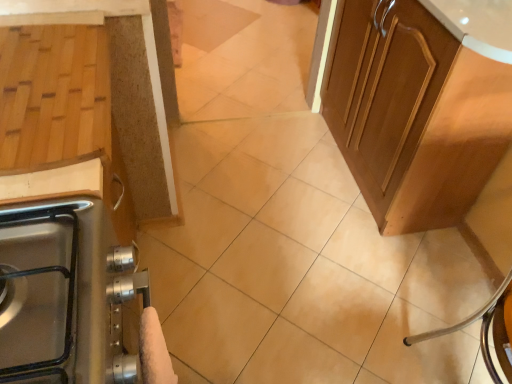
Where is `wooden cutting board at left, the 1th cabinetry when ordered from left to right`? This screenshot has height=384, width=512. wooden cutting board at left, the 1th cabinetry when ordered from left to right is located at coordinates (127, 87).

At what (x,y) coordinates should I click in order to perform the action: click on white fluffy hand towel at lower left. Please return your answer as a coordinate pair (x, y). The height and width of the screenshot is (384, 512). Looking at the image, I should click on [154, 351].

Where is `hand towel in front of the glossy wood cabinet at upper right, which is the 2th cabinetry in left-to-right order`? hand towel in front of the glossy wood cabinet at upper right, which is the 2th cabinetry in left-to-right order is located at coordinates (154, 351).

Based on the photo, from the image's perspective, is glossy wood cabinet at upper right, which is the 2th cabinetry in left-to-right order, above white fluffy hand towel at lower left?

Yes.

Could you tell me if glossy wood cabinet at upper right, which is counted as the first cabinetry, starting from the right, is facing white fluffy hand towel at lower left?

No, glossy wood cabinet at upper right, which is counted as the first cabinetry, starting from the right, does not turn towards white fluffy hand towel at lower left.

From a real-world perspective, is glossy wood cabinet at upper right, which is counted as the first cabinetry, starting from the right, positioned under white fluffy hand towel at lower left based on gravity?

Indeed, from a real-world perspective, glossy wood cabinet at upper right, which is counted as the first cabinetry, starting from the right, is positioned beneath white fluffy hand towel at lower left.

Which point is more forward, [110,9] or [402,203]?

The point [110,9] is closer to the camera.

Is wooden cutting board at left, positioned as the 2th cabinetry in right-to-left order, with glossy wood cabinet at upper right, which is the 2th cabinetry in left-to-right order?

wooden cutting board at left, positioned as the 2th cabinetry in right-to-left order, and glossy wood cabinet at upper right, which is the 2th cabinetry in left-to-right order, are not in contact.

Is wooden cutting board at left, positioned as the 2th cabinetry in right-to-left order, positioned beyond the bounds of glossy wood cabinet at upper right, which is counted as the first cabinetry, starting from the right?

wooden cutting board at left, positioned as the 2th cabinetry in right-to-left order, is positioned outside glossy wood cabinet at upper right, which is counted as the first cabinetry, starting from the right.

From a real-world perspective, is wooden cutting board at left, the 1th cabinetry when ordered from left to right, positioned over glossy wood cabinet at upper right, which is counted as the first cabinetry, starting from the right, based on gravity?

No, from a real-world perspective, wooden cutting board at left, the 1th cabinetry when ordered from left to right, is not over glossy wood cabinet at upper right, which is counted as the first cabinetry, starting from the right

Is white fluffy hand towel at lower left directly adjacent to wooden cutting board at left, the 1th cabinetry when ordered from left to right?

No.

From a real-world perspective, which object rests below the other?

From a 3D spatial view, wooden cutting board at left, positioned as the 2th cabinetry in right-to-left order, is below.

Is point (148, 322) positioned after point (117, 3)?

No, it is in front of (117, 3).

Who is bigger, white fluffy hand towel at lower left or wooden cutting board at left, positioned as the 2th cabinetry in right-to-left order?

wooden cutting board at left, positioned as the 2th cabinetry in right-to-left order, is bigger.

From a real-world perspective, is glossy wood cabinet at upper right, which is the 2th cabinetry in left-to-right order, positioned above or below wooden cutting board at left, positioned as the 2th cabinetry in right-to-left order?

glossy wood cabinet at upper right, which is the 2th cabinetry in left-to-right order, is situated higher than wooden cutting board at left, positioned as the 2th cabinetry in right-to-left order, in the real world.

Between glossy wood cabinet at upper right, which is the 2th cabinetry in left-to-right order, and wooden cutting board at left, the 1th cabinetry when ordered from left to right, which one has larger size?

glossy wood cabinet at upper right, which is the 2th cabinetry in left-to-right order.

Is glossy wood cabinet at upper right, which is the 2th cabinetry in left-to-right order, at the right side of wooden cutting board at left, the 1th cabinetry when ordered from left to right?

Yes, glossy wood cabinet at upper right, which is the 2th cabinetry in left-to-right order, is to the right of wooden cutting board at left, the 1th cabinetry when ordered from left to right.

Could you tell me if white fluffy hand towel at lower left is facing glossy wood cabinet at upper right, which is counted as the first cabinetry, starting from the right?

No, white fluffy hand towel at lower left is not aimed at glossy wood cabinet at upper right, which is counted as the first cabinetry, starting from the right.

In terms of width, does white fluffy hand towel at lower left look wider or thinner when compared to glossy wood cabinet at upper right, which is the 2th cabinetry in left-to-right order?

Considering their sizes, white fluffy hand towel at lower left looks slimmer than glossy wood cabinet at upper right, which is the 2th cabinetry in left-to-right order.

Based on the photo, between white fluffy hand towel at lower left and glossy wood cabinet at upper right, which is the 2th cabinetry in left-to-right order, which one has more height?

glossy wood cabinet at upper right, which is the 2th cabinetry in left-to-right order.

Is white fluffy hand towel at lower left far from glossy wood cabinet at upper right, which is counted as the first cabinetry, starting from the right?

Indeed, white fluffy hand towel at lower left is not near glossy wood cabinet at upper right, which is counted as the first cabinetry, starting from the right.

From the picture: Considering their positions, is wooden cutting board at left, positioned as the 2th cabinetry in right-to-left order, located in front of or behind white fluffy hand towel at lower left?

Clearly, wooden cutting board at left, positioned as the 2th cabinetry in right-to-left order, is behind white fluffy hand towel at lower left.

Considering the sizes of objects wooden cutting board at left, the 1th cabinetry when ordered from left to right, and white fluffy hand towel at lower left in the image provided, who is bigger, wooden cutting board at left, the 1th cabinetry when ordered from left to right, or white fluffy hand towel at lower left?

wooden cutting board at left, the 1th cabinetry when ordered from left to right, is bigger.

Would you say wooden cutting board at left, the 1th cabinetry when ordered from left to right, is outside white fluffy hand towel at lower left?

Yes, wooden cutting board at left, the 1th cabinetry when ordered from left to right, is not within white fluffy hand towel at lower left.

The height and width of the screenshot is (384, 512). Find the location of `cabinetry that appears on the right of white fluffy hand towel at lower left`. cabinetry that appears on the right of white fluffy hand towel at lower left is located at coordinates (420, 104).

This screenshot has width=512, height=384. Identify the location of cabinetry below the glossy wood cabinet at upper right, which is the 2th cabinetry in left-to-right order (from a real-world perspective). (127, 87).

Based on the photo, which object lies further to the anchor point glossy wood cabinet at upper right, which is counted as the first cabinetry, starting from the right, wooden cutting board at left, positioned as the 2th cabinetry in right-to-left order, or white fluffy hand towel at lower left?

The object further to glossy wood cabinet at upper right, which is counted as the first cabinetry, starting from the right, is white fluffy hand towel at lower left.

Based on the photo, from the image, which object appears to be nearer to white fluffy hand towel at lower left, wooden cutting board at left, the 1th cabinetry when ordered from left to right, or glossy wood cabinet at upper right, which is counted as the first cabinetry, starting from the right?

Among the two, wooden cutting board at left, the 1th cabinetry when ordered from left to right, is located nearer to white fluffy hand towel at lower left.

Looking at the image, which one is located further to glossy wood cabinet at upper right, which is counted as the first cabinetry, starting from the right, white fluffy hand towel at lower left or wooden cutting board at left, the 1th cabinetry when ordered from left to right?

The object further to glossy wood cabinet at upper right, which is counted as the first cabinetry, starting from the right, is white fluffy hand towel at lower left.

Which object lies nearer to the anchor point wooden cutting board at left, the 1th cabinetry when ordered from left to right, glossy wood cabinet at upper right, which is the 2th cabinetry in left-to-right order, or white fluffy hand towel at lower left?

white fluffy hand towel at lower left lies closer to wooden cutting board at left, the 1th cabinetry when ordered from left to right, than the other object.

Looking at the image, which one is located closer to white fluffy hand towel at lower left, glossy wood cabinet at upper right, which is the 2th cabinetry in left-to-right order, or wooden cutting board at left, the 1th cabinetry when ordered from left to right?

wooden cutting board at left, the 1th cabinetry when ordered from left to right.

Considering their positions, is white fluffy hand towel at lower left positioned further to wooden cutting board at left, positioned as the 2th cabinetry in right-to-left order, than glossy wood cabinet at upper right, which is counted as the first cabinetry, starting from the right?

Among the two, glossy wood cabinet at upper right, which is counted as the first cabinetry, starting from the right, is located further to wooden cutting board at left, positioned as the 2th cabinetry in right-to-left order.

At what (x,y) coordinates should I click in order to perform the action: click on hand towel between wooden cutting board at left, the 1th cabinetry when ordered from left to right, and glossy wood cabinet at upper right, which is counted as the first cabinetry, starting from the right, from left to right. Please return your answer as a coordinate pair (x, y). This screenshot has width=512, height=384. Looking at the image, I should click on (154, 351).